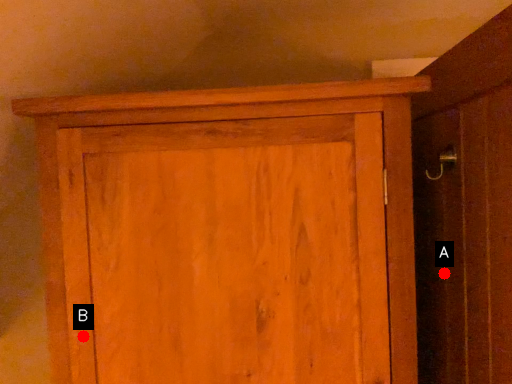
Question: Two points are circled on the image, labeled by A and B beside each circle. Which point is closer to the camera?

Choices:
 (A) A is closer
 (B) B is closer

Answer: (B)